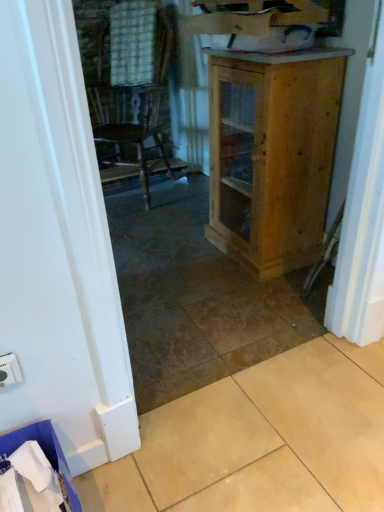
Question: Is the surface of beige tile at lower right in direct contact with white plastic electric outlet at lower left?

Choices:
 (A) no
 (B) yes

Answer: (A)

Question: Would you say beige tile at lower right is a long distance from white plastic electric outlet at lower left?

Choices:
 (A) yes
 (B) no

Answer: (B)

Question: From a real-world perspective, is beige tile at lower right physically below white plastic electric outlet at lower left?

Choices:
 (A) no
 (B) yes

Answer: (B)

Question: Does beige tile at lower right appear on the right side of white plastic electric outlet at lower left?

Choices:
 (A) no
 (B) yes

Answer: (B)

Question: Is beige tile at lower right looking in the opposite direction of white plastic electric outlet at lower left?

Choices:
 (A) no
 (B) yes

Answer: (A)

Question: Is white plastic electric outlet at lower left inside or outside of natural wood cabinet at center?

Choices:
 (A) inside
 (B) outside

Answer: (B)

Question: From a real-world perspective, relative to natural wood cabinet at center, is white plastic electric outlet at lower left vertically above or below?

Choices:
 (A) above
 (B) below

Answer: (B)

Question: In the image, is white plastic electric outlet at lower left positioned in front of or behind natural wood cabinet at center?

Choices:
 (A) front
 (B) behind

Answer: (A)

Question: Is white plastic electric outlet at lower left wider or thinner than natural wood cabinet at center?

Choices:
 (A) thin
 (B) wide

Answer: (A)

Question: In terms of height, does natural wood cabinet at center look taller or shorter compared to beige tile at lower right?

Choices:
 (A) tall
 (B) short

Answer: (A)

Question: Is natural wood cabinet at center to the left or to the right of beige tile at lower right in the image?

Choices:
 (A) left
 (B) right

Answer: (B)

Question: Considering the positions of natural wood cabinet at center and beige tile at lower right in the image, is natural wood cabinet at center wider or thinner than beige tile at lower right?

Choices:
 (A) wide
 (B) thin

Answer: (B)

Question: From the image's perspective, is natural wood cabinet at center located above or below beige tile at lower right?

Choices:
 (A) above
 (B) below

Answer: (A)

Question: From the image's perspective, is natural wood cabinet at center located above or below white plastic electric outlet at lower left?

Choices:
 (A) above
 (B) below

Answer: (A)

Question: Is natural wood cabinet at center spatially inside white plastic electric outlet at lower left, or outside of it?

Choices:
 (A) outside
 (B) inside

Answer: (A)